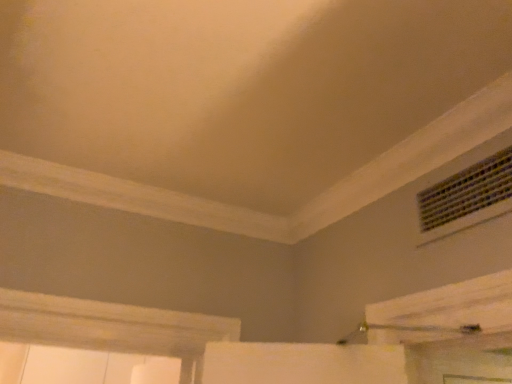
Question: Should I look upward or downward to see metallic grid air conditioning at upper right?

Choices:
 (A) down
 (B) up

Answer: (B)